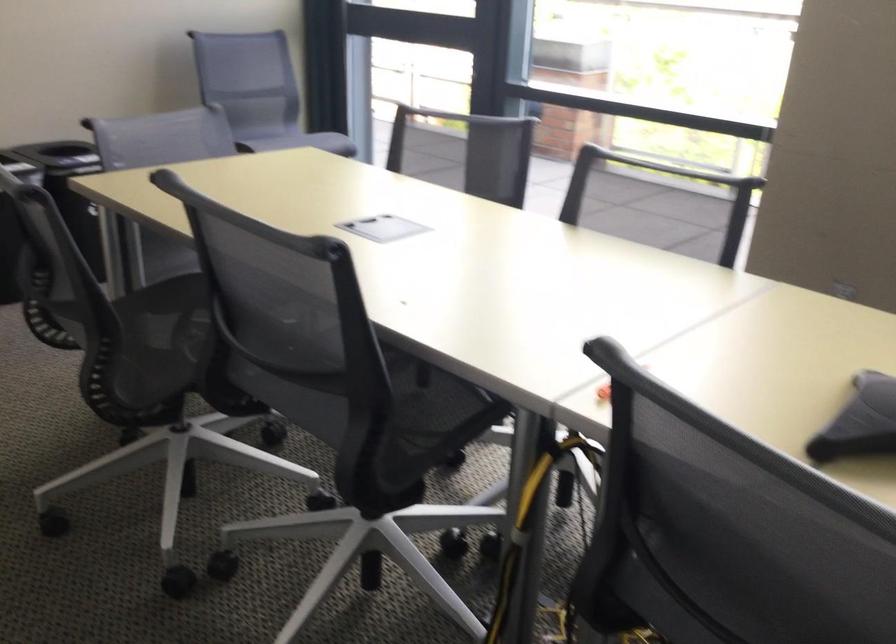
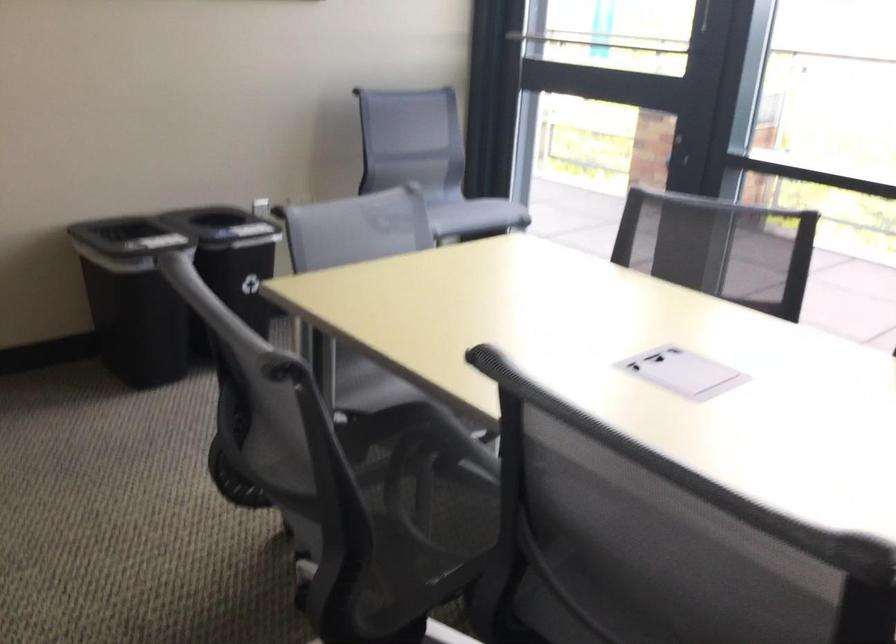
The point at (x=177, y=251) is marked in the first image. Where is the corresponding point in the second image?

(356, 361)